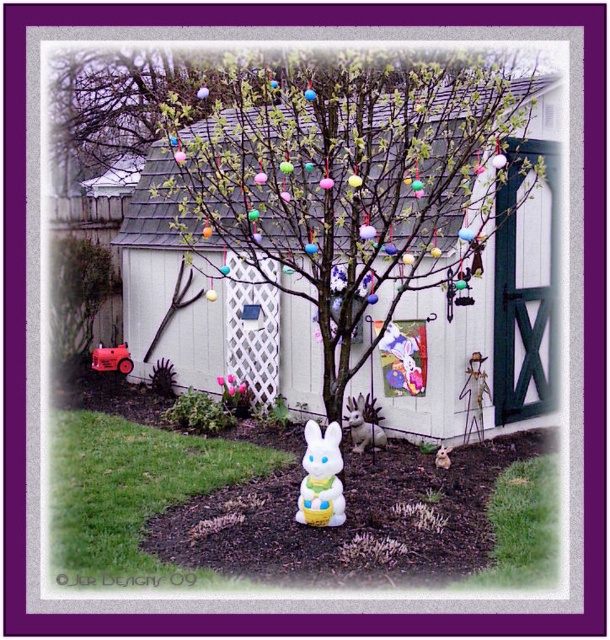
Question: Observing the image, what is the correct spatial positioning of white glossy plastic bunny at center in reference to white plastic bunny at center?

Choices:
 (A) below
 (B) above

Answer: (A)

Question: Which object appears closest to the camera in this image?

Choices:
 (A) white glossy plastic bunny at center
 (B) white wood at center
 (C) white plastic bunny at center

Answer: (A)

Question: In this image, where is white glossy plastic bunny at center located relative to white plastic bunny at center?

Choices:
 (A) left
 (B) right

Answer: (B)

Question: Which object is farther from the camera taking this photo?

Choices:
 (A) white wood at center
 (B) white plastic bunny at center

Answer: (B)

Question: Is white wood at center wider than white glossy plastic bunny at center?

Choices:
 (A) no
 (B) yes

Answer: (A)

Question: Among these points, which one is nearest to the camera?

Choices:
 (A) (303, 493)
 (B) (284, 515)
 (C) (196, 364)

Answer: (A)